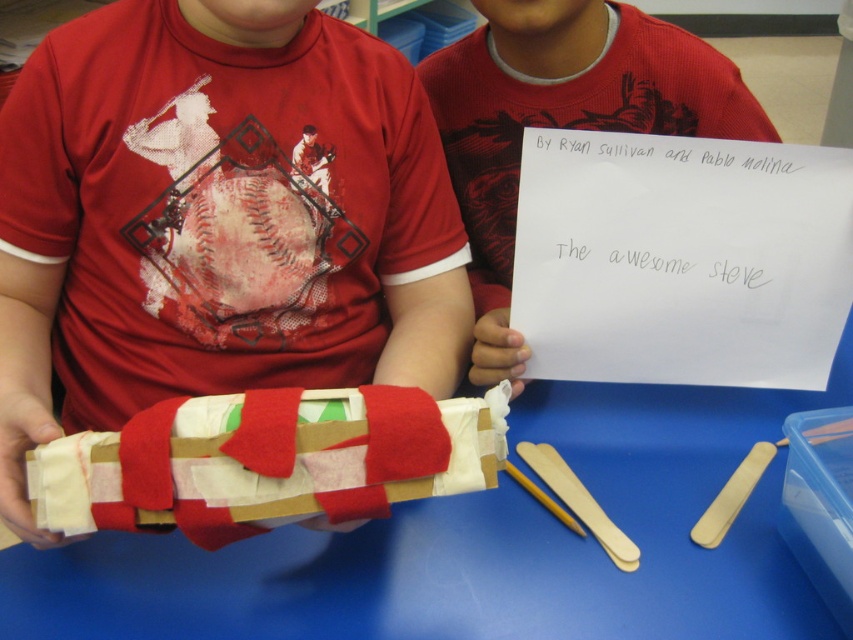
Who is more forward, (161, 384) or (64, 481)?

Point (64, 481)

How far apart are cardboard box at center and felt wrapped book at center?

25.90 centimeters

The height and width of the screenshot is (640, 853). Identify the location of cardboard box at center. (216, 220).

Where is `cardboard box at center`? The width and height of the screenshot is (853, 640). cardboard box at center is located at coordinates (216, 220).

In the scene shown: Which is more to the right, cardboard box at center or matte felt sign at upper center?

matte felt sign at upper center is more to the right.

Is the position of cardboard box at center less distant than that of matte felt sign at upper center?

Yes, it is.

This screenshot has height=640, width=853. In order to click on cardboard box at center in this screenshot , I will do `click(216, 220)`.

Can you confirm if felt wrapped book at center is positioned above matte felt sign at upper center?

Incorrect, felt wrapped book at center is not positioned above matte felt sign at upper center.

Which is in front, point (364, 435) or point (486, 29)?

Point (364, 435) is in front.

Identify the location of felt wrapped book at center. The width and height of the screenshot is (853, 640). (267, 460).

Find the location of a particular element. felt wrapped book at center is located at coordinates (267, 460).